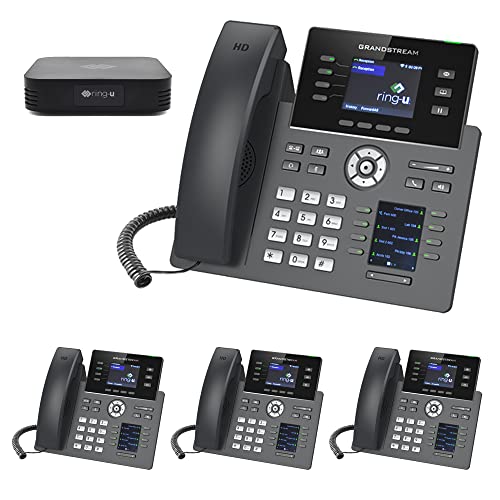
Find the location of a particular element. This screenshot has height=500, width=500. screen is located at coordinates (379, 95), (127, 376), (277, 380), (439, 379).